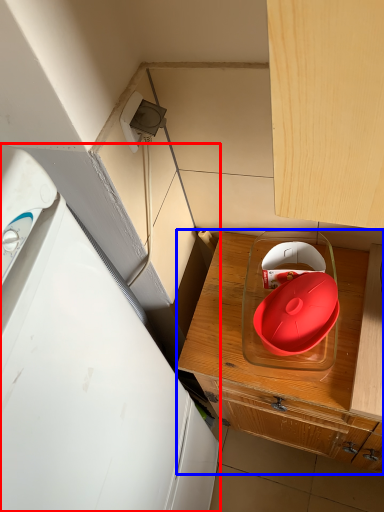
Question: Which object is further to the camera taking this photo, home appliance (highlighted by a red box) or cabinetry (highlighted by a blue box)?

Choices:
 (A) home appliance
 (B) cabinetry

Answer: (B)